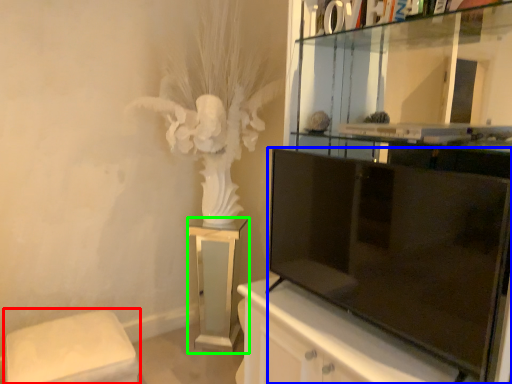
Question: Considering the real-world distances, which object is closest to furniture (highlighted by a red box)? television (highlighted by a blue box) or furniture (highlighted by a green box).

Choices:
 (A) television
 (B) furniture

Answer: (B)